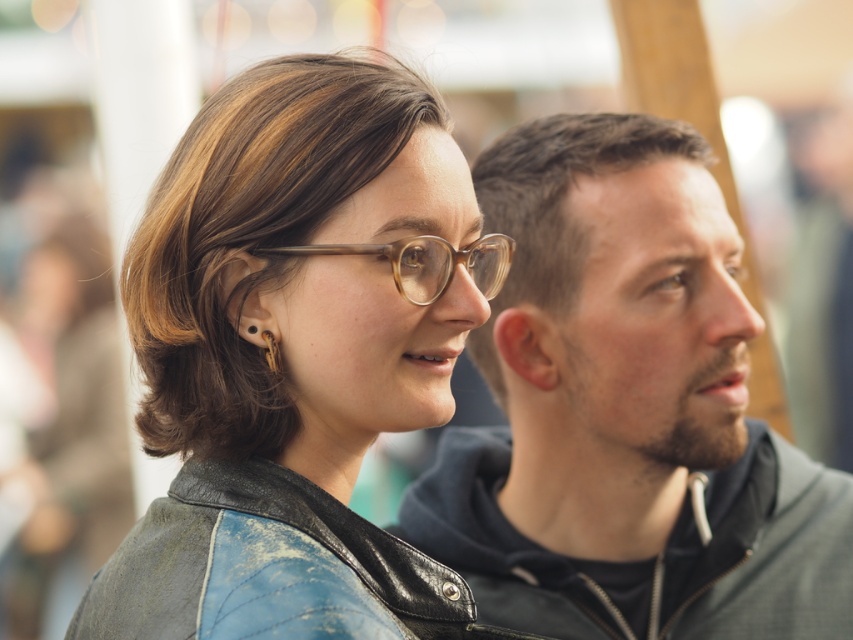
Question: Observing the image, what is the correct spatial positioning of matte gray hoodie at center in reference to translucent amber eyeglasses at center?

Choices:
 (A) below
 (B) above

Answer: (A)

Question: Is matte gray hoodie at center positioned at the back of translucent amber eyeglasses at center?

Choices:
 (A) yes
 (B) no

Answer: (A)

Question: Which is nearer to the translucent amber eyeglasses at center?

Choices:
 (A) leather jacket at upper left
 (B) matte gray hoodie at center

Answer: (A)

Question: Which of the following is the closest to the observer?

Choices:
 (A) (753, 330)
 (B) (471, 268)
 (C) (350, 202)

Answer: (C)

Question: Considering the real-world distances, which object is farthest from the leather jacket at upper left?

Choices:
 (A) matte gray hoodie at center
 (B) translucent amber eyeglasses at center

Answer: (A)

Question: Is leather jacket at upper left closer to the viewer compared to matte gray hoodie at center?

Choices:
 (A) no
 (B) yes

Answer: (B)